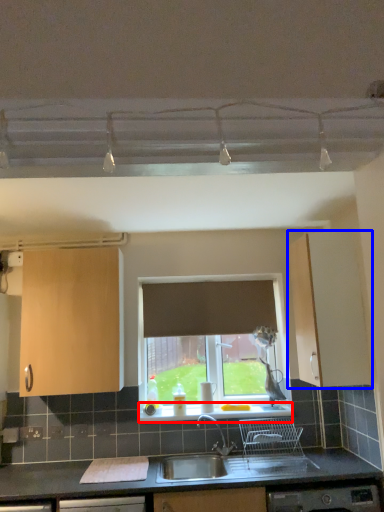
Question: Which object appears closest to the camera in this image, window sill (highlighted by a red box) or cabinetry (highlighted by a blue box)?

Choices:
 (A) window sill
 (B) cabinetry

Answer: (B)